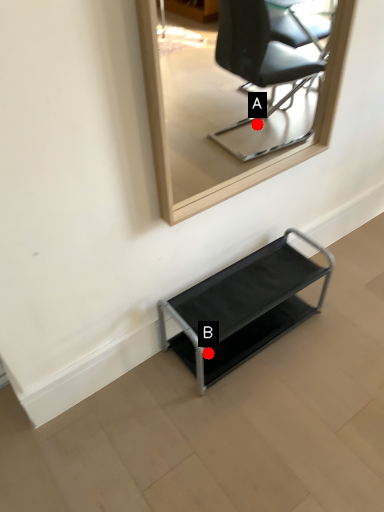
Question: Two points are circled on the image, labeled by A and B beside each circle. Among these points, which one is nearest to the camera?

Choices:
 (A) A is closer
 (B) B is closer

Answer: (B)